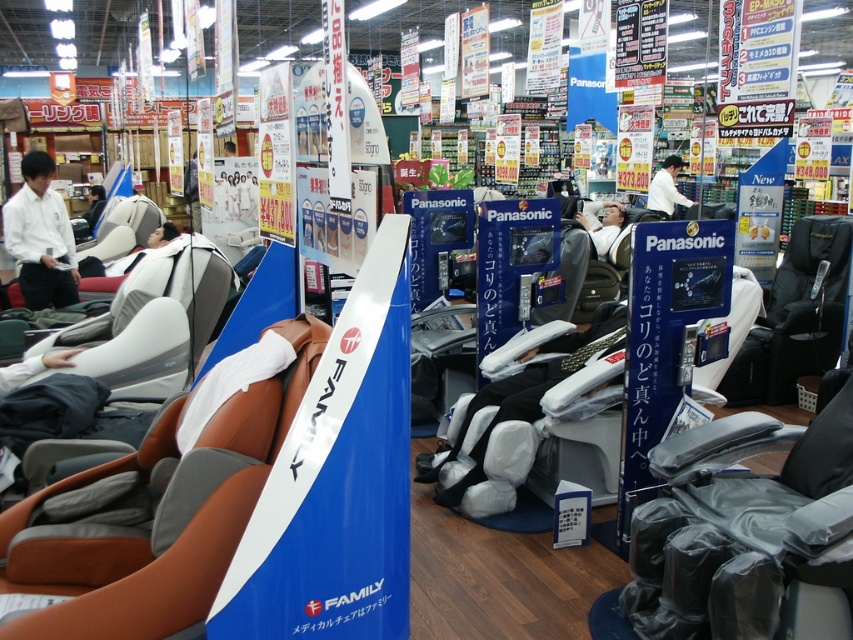
Question: Among these points, which one is nearest to the camera?

Choices:
 (A) (49, 192)
 (B) (695, 500)

Answer: (B)

Question: In this image, where is brown leather swivel chair at center located relative to black leather massage chair at center?

Choices:
 (A) above
 (B) below

Answer: (B)

Question: Can you confirm if brown leather swivel chair at center is bigger than white shirt at upper center?

Choices:
 (A) yes
 (B) no

Answer: (A)

Question: Which point is farther from the camera taking this photo?

Choices:
 (A) (222, 360)
 (B) (96, 216)
 (C) (669, 177)

Answer: (C)

Question: Is black leather swivel chair at center smaller than white shirt at upper center?

Choices:
 (A) no
 (B) yes

Answer: (A)

Question: Based on their relative distances, which object is nearer to the matte black chair at center?

Choices:
 (A) black leather massage chair at center
 (B) white shirt at left

Answer: (B)